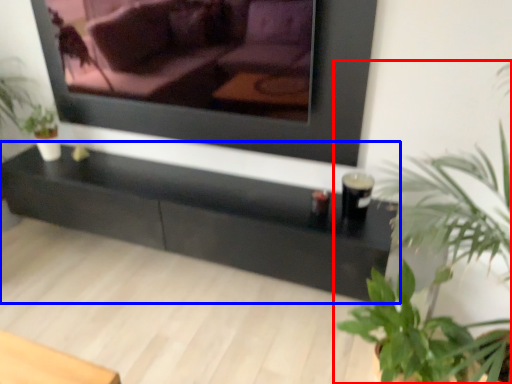
Question: Which object appears closest to the camera in this image, houseplant (highlighted by a red box) or table (highlighted by a blue box)?

Choices:
 (A) houseplant
 (B) table

Answer: (A)